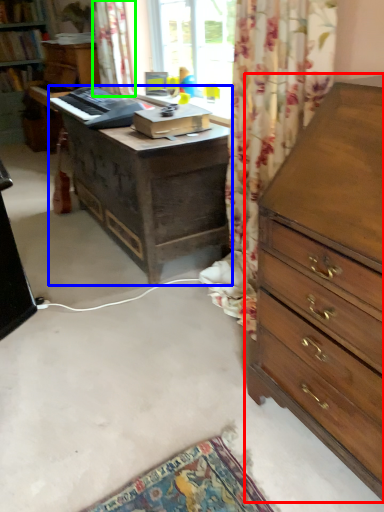
Question: Considering the real-world distances, which object is farthest from chest of drawers (highlighted by a red box)? desk (highlighted by a blue box) or curtain (highlighted by a green box)?

Choices:
 (A) desk
 (B) curtain

Answer: (B)